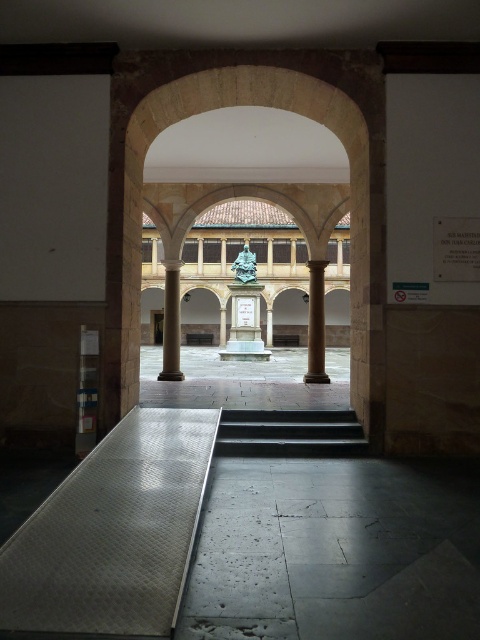
From the picture: You are a wheelchair user wanting to enter the courtyard through the arched opening. The silver textured ramp at lower left and the black polished stone stairs at center are your options. Which path can you take to access the courtyard?

The silver textured ramp at lower left is above the black polished stone stairs at center, so the wheelchair user can use the silver textured ramp at lower left to access the courtyard since it is designed for accessibility.

Looking at this image, you are an architect designing a new pathway that needs to be as wide as the smooth stone column at center. You currently have a silver textured ramp at lower left. Can you use it as the pathway without modification?

The silver textured ramp at lower left is thinner than the smooth stone column at center, so it cannot be used as the pathway without modification since it is narrower than the required width.

You are an architect designing a new pathway. You need to decide whether to place a decorative statue on the silver textured ramp at lower left or the brown polished stone column at center. Based on their sizes, which location has enough space for the statue?

The brown polished stone column at center has more space since the silver textured ramp at lower left occupies less space than it, so placing the statue there would be better.